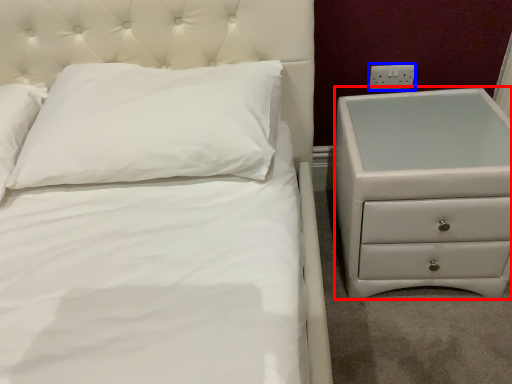
Question: Which object is further to the camera taking this photo, chest of drawers (highlighted by a red box) or electric outlet (highlighted by a blue box)?

Choices:
 (A) chest of drawers
 (B) electric outlet

Answer: (B)